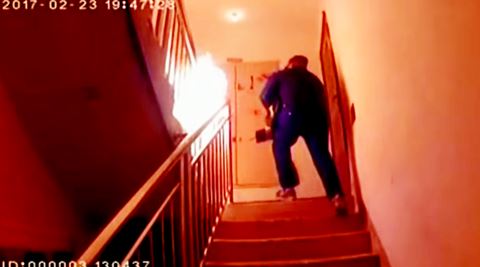
This screenshot has height=267, width=480. Find the location of `lights`. lights is located at coordinates (236, 21).